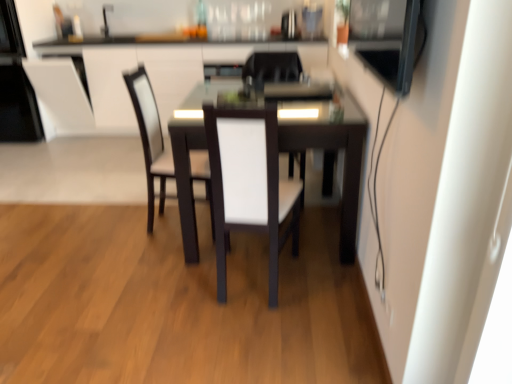
Where is `vacant space in front of white leather chair at center, which is the second chair in back-to-front order`? The image size is (512, 384). vacant space in front of white leather chair at center, which is the second chair in back-to-front order is located at coordinates click(x=155, y=259).